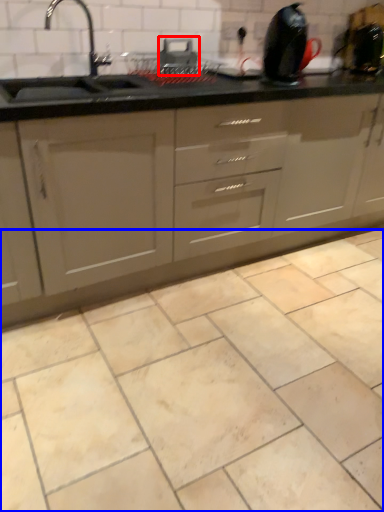
Question: Among these objects, which one is nearest to the camera, appliance (highlighted by a red box) or ceramic tile (highlighted by a blue box)?

Choices:
 (A) appliance
 (B) ceramic tile

Answer: (B)